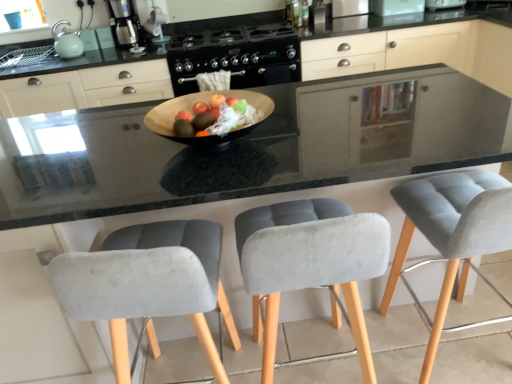
Question: Would you say satin silver coffee maker at upper left is to the left or to the right of velvet grey chair at center, positioned as the second chair in right-to-left order, in the picture?

Choices:
 (A) left
 (B) right

Answer: (A)

Question: Which is correct: satin silver coffee maker at upper left is inside velvet grey chair at center, positioned as the second chair in right-to-left order, or outside of it?

Choices:
 (A) outside
 (B) inside

Answer: (A)

Question: Considering the real-world distances, which object is farthest from the velvet grey bar stool at right, marked as the first chair in a right-to-left arrangement?

Choices:
 (A) satin silver coffee maker at upper left
 (B) black matte gas stove at center
 (C) brushed metal toaster at upper center, the first appliance when ordered from right to left
 (D) white glossy coffee maker at upper center, the second appliance positioned from the left
 (E) matte green kettle at upper left, which is counted as the 5th appliance, starting from the right

Answer: (E)

Question: Estimate the real-world distances between objects in this image. Which object is closer to the matte green kettle at upper left, which is counted as the 5th appliance, starting from the right?

Choices:
 (A) velvet grey chair at center, positioned as the 2th chair in left-to-right order
 (B) brushed metal toaster at upper center, the first appliance when ordered from right to left
 (C) white glossy coffee maker at upper center, the fourth appliance in the right-to-left sequence
 (D) gray fabric chair at center, arranged as the 1th chair when viewed from the left
 (E) velvet grey bar stool at right, the 3th chair positioned from the left

Answer: (C)